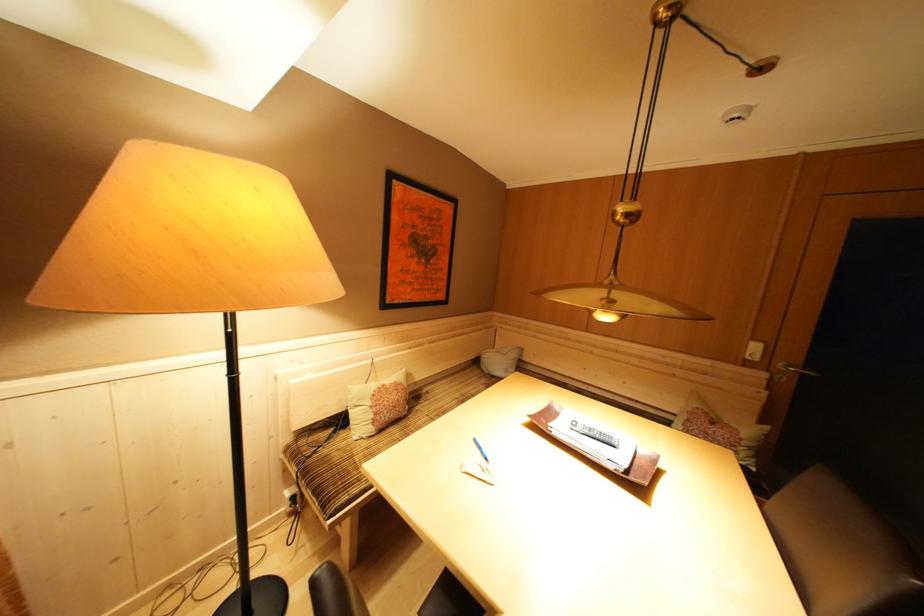
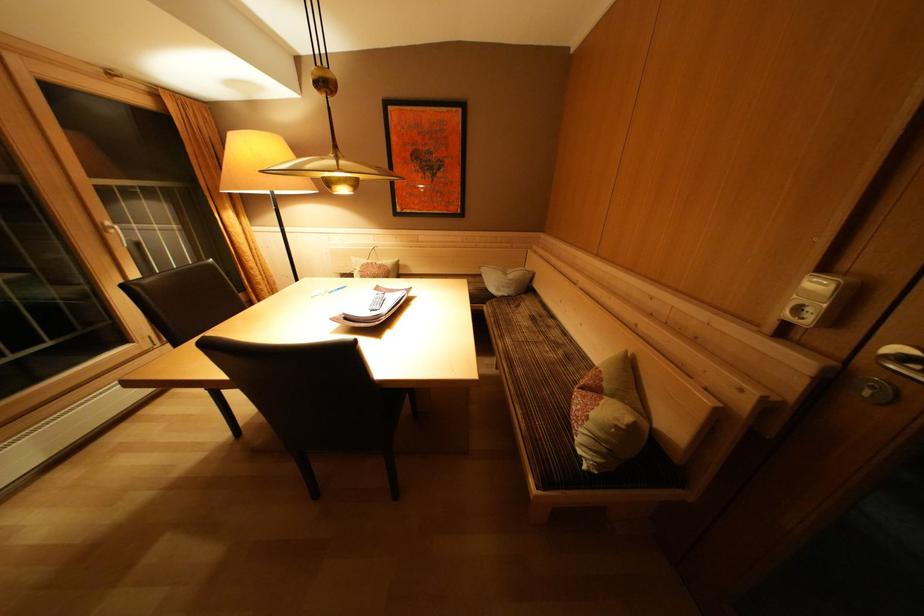
Question: I am providing you with two images of the same scene from different viewpoints. Please identify which objects are invisible in image2.

Choices:
 (A) white window handle
 (B) patterned cushion
 (C) sofa sitting surface
 (D) none of these

Answer: (D)